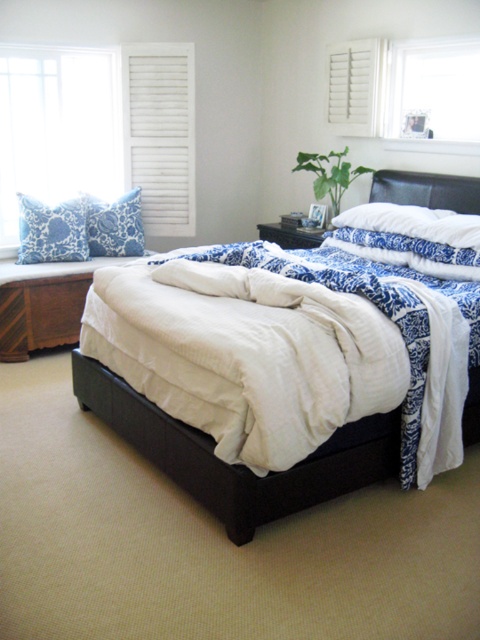
Between white wooden window at upper right and white wooden shutter at upper center, which one is positioned lower?

Positioned lower is white wooden window at upper right.

Who is shorter, white wooden window at upper right or white wooden shutter at upper center?

Standing shorter between the two is white wooden shutter at upper center.

Between point (400, 68) and point (337, 74), which one is positioned in front?

Point (400, 68)

Locate an element on the screen. white wooden window at upper right is located at coordinates (408, 92).

Can you confirm if matte black bed at center is positioned to the right of white wooden window at upper right?

No, matte black bed at center is not to the right of white wooden window at upper right.

Does matte black bed at center have a smaller size compared to white wooden window at upper right?

No.

Describe the element at coordinates (238, 465) in the screenshot. The image size is (480, 640). I see `matte black bed at center` at that location.

Image resolution: width=480 pixels, height=640 pixels. In order to click on matte black bed at center in this screenshot , I will do `click(238, 465)`.

Can you confirm if blue printed fabric pillow at upper left is positioned above blue printed pillow at upper left?

No.

Does blue printed fabric pillow at upper left appear on the left side of blue printed pillow at upper left?

Correct, you'll find blue printed fabric pillow at upper left to the left of blue printed pillow at upper left.

Who is more distant from viewer, [73,240] or [133,252]?

The point [133,252] is behind.

Where is `blue printed fabric pillow at upper left`? blue printed fabric pillow at upper left is located at coordinates (51, 230).